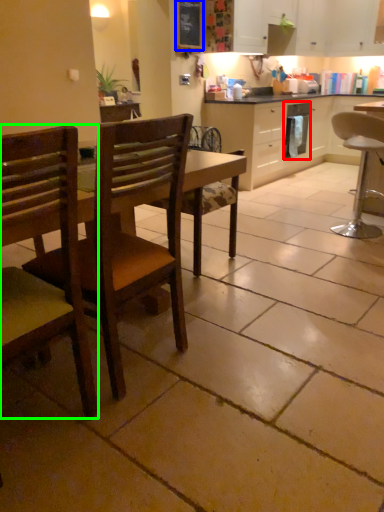
Question: Considering the real-world distances, which object is farthest from dish washer (highlighted by a red box)? bulletin board (highlighted by a blue box) or chair (highlighted by a green box)?

Choices:
 (A) bulletin board
 (B) chair

Answer: (B)